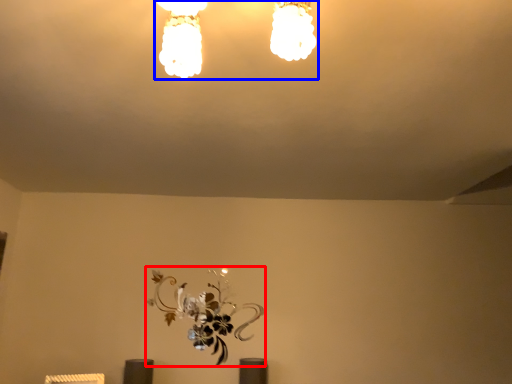
Question: Among these objects, which one is farthest to the camera, flower (highlighted by a red box) or lamp (highlighted by a blue box)?

Choices:
 (A) flower
 (B) lamp

Answer: (A)